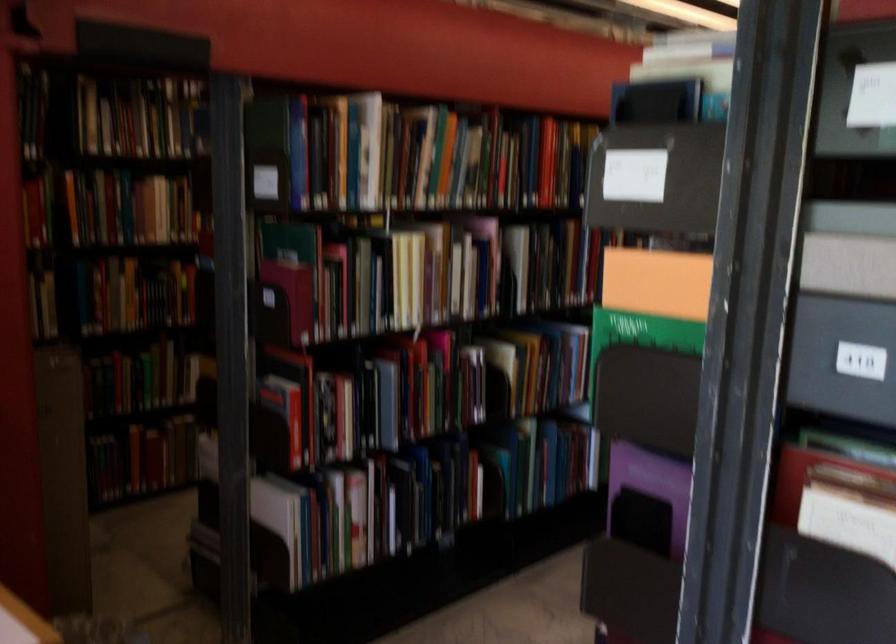
Find the location of a particular element. This screenshot has width=896, height=644. orange folder is located at coordinates (657, 283).